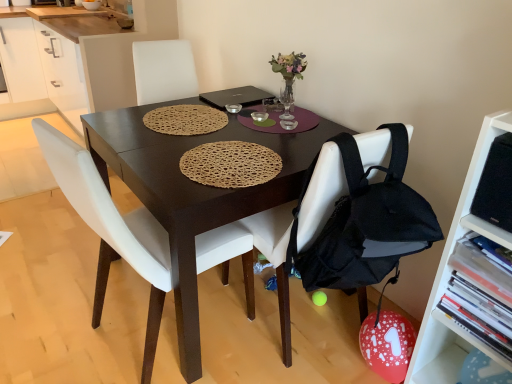
This screenshot has height=384, width=512. I want to click on vacant region to the left of white leather chair at center, positioned as the second chair in right-to-left order, so click(61, 312).